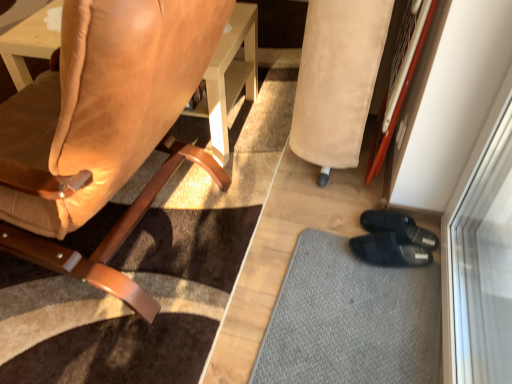
Question: Does suede leather chair at left come behind beige suede bean bag chair at lower right?

Choices:
 (A) yes
 (B) no

Answer: (B)

Question: Is suede leather chair at left directly adjacent to beige suede bean bag chair at lower right?

Choices:
 (A) no
 (B) yes

Answer: (A)

Question: Considering the relative sizes of suede leather chair at left and beige suede bean bag chair at lower right in the image provided, is suede leather chair at left thinner than beige suede bean bag chair at lower right?

Choices:
 (A) yes
 (B) no

Answer: (B)

Question: Is suede leather chair at left far away from beige suede bean bag chair at lower right?

Choices:
 (A) yes
 (B) no

Answer: (B)

Question: Is suede leather chair at left positioned with its back to beige suede bean bag chair at lower right?

Choices:
 (A) yes
 (B) no

Answer: (B)

Question: From a real-world perspective, is suede leather chair at left located beneath beige suede bean bag chair at lower right?

Choices:
 (A) no
 (B) yes

Answer: (A)

Question: Would you say suede leather chair at left is part of gray textured mat at lower right's contents?

Choices:
 (A) no
 (B) yes

Answer: (A)

Question: Considering the relative positions of gray textured mat at lower right and suede leather chair at left in the image provided, is gray textured mat at lower right behind suede leather chair at left?

Choices:
 (A) no
 (B) yes

Answer: (B)

Question: From the image's perspective, is gray textured mat at lower right on top of suede leather chair at left?

Choices:
 (A) yes
 (B) no

Answer: (B)

Question: From a real-world perspective, is gray textured mat at lower right located beneath suede leather chair at left?

Choices:
 (A) yes
 (B) no

Answer: (A)

Question: Considering the relative sizes of gray textured mat at lower right and suede leather chair at left in the image provided, is gray textured mat at lower right smaller than suede leather chair at left?

Choices:
 (A) yes
 (B) no

Answer: (A)

Question: Considering the relative positions of gray textured mat at lower right and suede leather chair at left in the image provided, is gray textured mat at lower right to the right of suede leather chair at left from the viewer's perspective?

Choices:
 (A) yes
 (B) no

Answer: (A)

Question: Is beige suede bean bag chair at lower right in contact with gray textured mat at lower right?

Choices:
 (A) no
 (B) yes

Answer: (A)